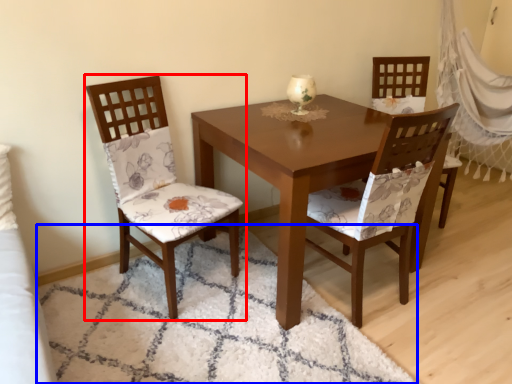
Question: Among these objects, which one is farthest to the camera, chair (highlighted by a red box) or mat (highlighted by a blue box)?

Choices:
 (A) chair
 (B) mat

Answer: (A)